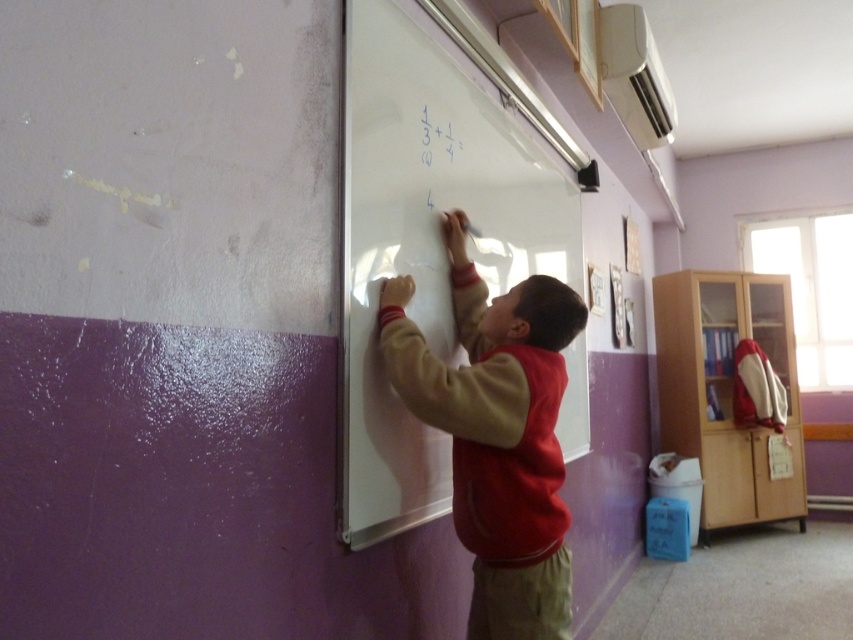
Question: Is whiteboard at center above red fleece vest at center?

Choices:
 (A) yes
 (B) no

Answer: (A)

Question: Does whiteboard at center come in front of red fleece vest at center?

Choices:
 (A) no
 (B) yes

Answer: (B)

Question: Can you confirm if whiteboard at center is wider than red fleece vest at center?

Choices:
 (A) no
 (B) yes

Answer: (B)

Question: Which object appears farthest from the camera in this image?

Choices:
 (A) whiteboard at center
 (B) red fleece vest at center

Answer: (B)

Question: Which of the following is the closest to the observer?

Choices:
 (A) (521, 444)
 (B) (437, 147)

Answer: (A)